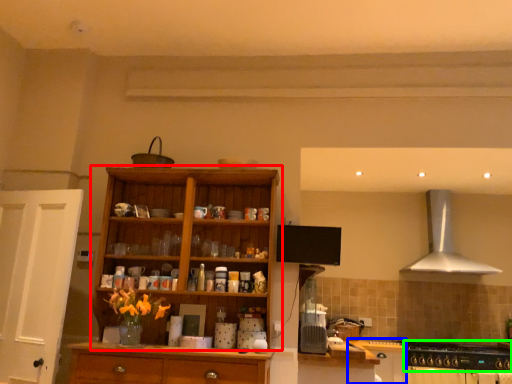
Question: Which object is the closest to the cupboard (highlighted by a red box)? Choose among these: cabinetry (highlighted by a blue box) or gas stove (highlighted by a green box).

Choices:
 (A) cabinetry
 (B) gas stove

Answer: (A)